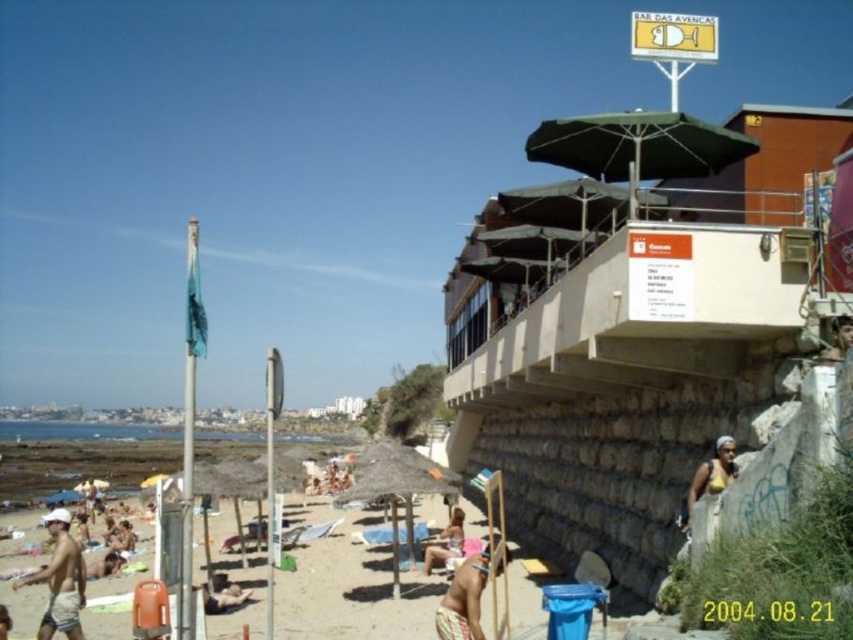
Question: Can you confirm if green fabric umbrella at upper right is wider than tan skin person at center?

Choices:
 (A) yes
 (B) no

Answer: (A)

Question: Which is farther from the tan skin person at beach center?

Choices:
 (A) beige straw umbrella at center
 (B) green fabric umbrella at upper right
 (C) tan skin person at center

Answer: (A)

Question: Which object is farther from the camera taking this photo?

Choices:
 (A) tan skin person at beach center
 (B) green fabric umbrella at upper right
 (C) beige textured shorts at lower center

Answer: (A)

Question: Can you confirm if tan skin person at center is smaller than tan skin person at lower left?

Choices:
 (A) yes
 (B) no

Answer: (A)

Question: Does tan skin person at lower left have a smaller size compared to tan skin human at lower left?

Choices:
 (A) no
 (B) yes

Answer: (A)

Question: Which of the following is the closest to the observer?

Choices:
 (A) green fabric umbrella at upper right
 (B) tan skin human at lower left
 (C) beige straw umbrella at center

Answer: (A)